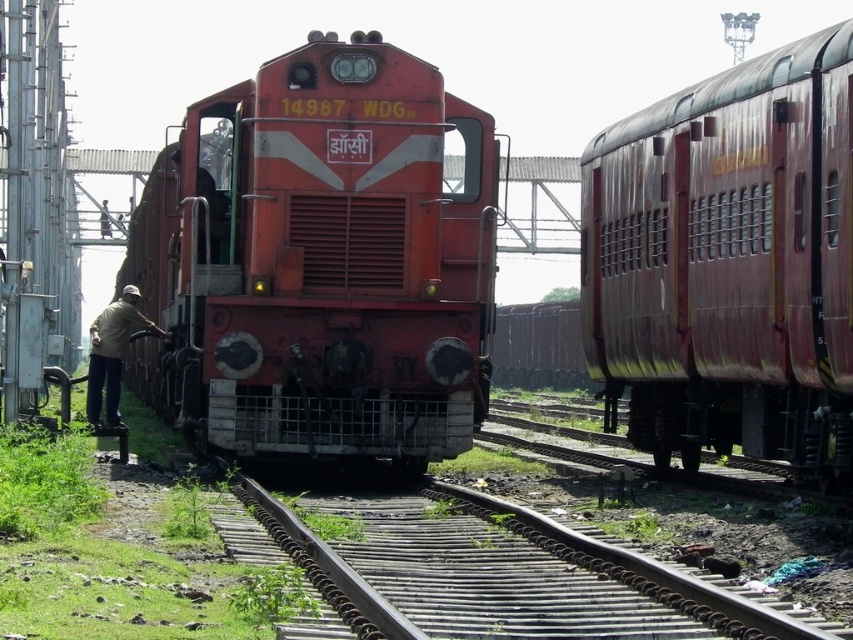
Question: Which point appears farthest from the camera in this image?

Choices:
 (A) (686, 436)
 (B) (224, 369)
 (C) (538, 538)
 (D) (109, 413)

Answer: (D)

Question: Which object is farther from the camera taking this photo?

Choices:
 (A) rusty metal train track at center
 (B) matte red locomotive at center

Answer: (B)

Question: Does rusty metal train car at right appear over light brown fabric cap at left?

Choices:
 (A) yes
 (B) no

Answer: (A)

Question: Is the position of matte red locomotive at center less distant than that of light brown fabric cap at left?

Choices:
 (A) yes
 (B) no

Answer: (A)

Question: Is matte red locomotive at center below light brown fabric cap at left?

Choices:
 (A) no
 (B) yes

Answer: (A)

Question: Which is farther from the light brown fabric cap at left?

Choices:
 (A) rusty metal train car at right
 (B) matte red locomotive at center
 (C) rusty metal train track at center

Answer: (A)